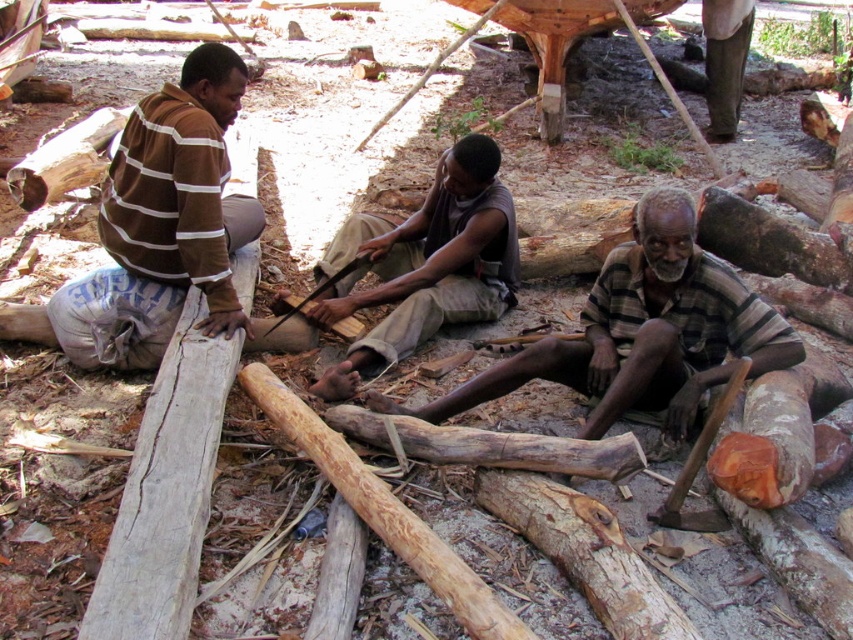
Question: Which object is positioned closest to the smooth brown wood at center?

Choices:
 (A) brown striped sweater at left
 (B) striped fabric shirt at center

Answer: (A)

Question: Is striped fabric shirt at center thinner than smooth brown wood at center?

Choices:
 (A) no
 (B) yes

Answer: (A)

Question: From the image, what is the correct spatial relationship of brown striped sweater at left in relation to smooth brown wood at center?

Choices:
 (A) right
 (B) left

Answer: (B)

Question: Which of these objects is positioned closest to the smooth brown wood at center?

Choices:
 (A) striped fabric shirt at center
 (B) brown striped sweater at left

Answer: (B)

Question: Which object is positioned closest to the smooth brown wood at center?

Choices:
 (A) brown striped sweater at left
 (B) striped fabric shirt at center

Answer: (A)

Question: Considering the relative positions of brown striped sweater at left and smooth brown wood at center in the image provided, where is brown striped sweater at left located with respect to smooth brown wood at center?

Choices:
 (A) below
 (B) above

Answer: (B)